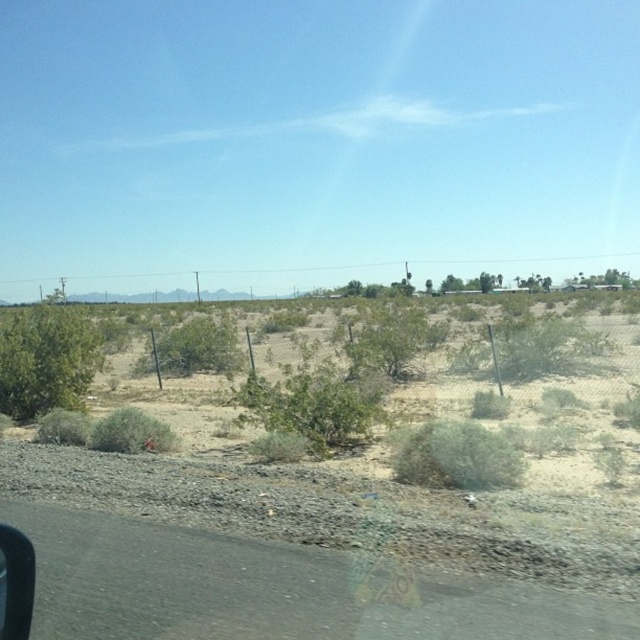
You are standing in the desert and see the green leafy bush at center. If you walk straight towards it, how many steps would you need to take to reach the bush? Assume each step covers 2.5 feet.

The distance between you and the green leafy bush at center is 36.56 feet. Dividing this by 2.5 feet per step gives approximately 14.62 steps. Since you can only take whole steps, you would need to take 15 steps to reach the bush.

You are standing at the lower left corner of the image and want to walk towards the green leafy bush at center. Which direction should you move relative to the black rubber car window at lower left?

The green leafy bush at center is to the right of the black rubber car window at lower left. Therefore, you should move to the right of the black rubber car window at lower left to reach the green leafy bush at center.

You are a desert explorer trying to navigate between the green leafy bush at center and the green shrub at center. Which one has a narrower width?

The green leafy bush at center is thinner than the green shrub at center, so the green leafy bush at center has a narrower width.